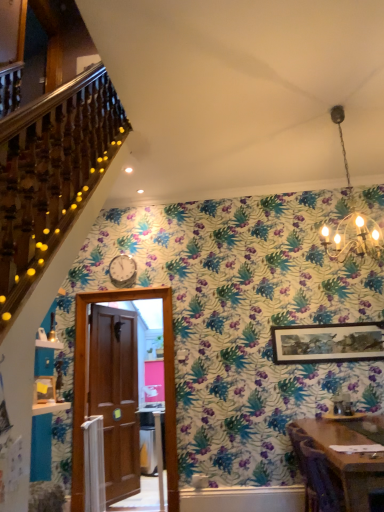
Where is `empty space that is ontop of wooden framed artwork at upper right (from a real-world perspective)`? The image size is (384, 512). empty space that is ontop of wooden framed artwork at upper right (from a real-world perspective) is located at coordinates click(324, 325).